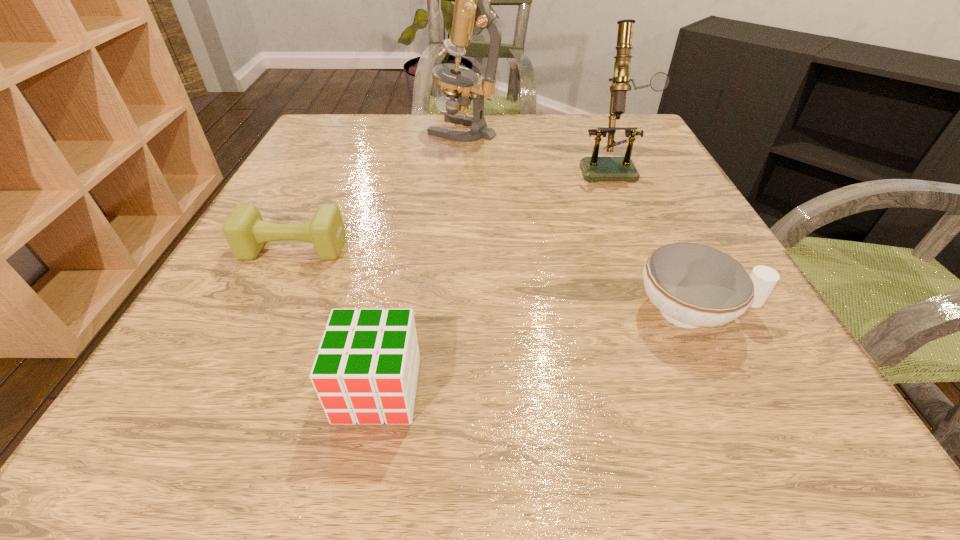
Image resolution: width=960 pixels, height=540 pixels. Find the location of `free point located at the eyepiece of the shorter microscope`. free point located at the eyepiece of the shorter microscope is located at coordinates (637, 228).

At what (x,y) coordinates should I click in order to perform the action: click on free region located on the right of the third nearest object. Please return your answer as a coordinate pair (x, y). The height and width of the screenshot is (540, 960). Looking at the image, I should click on (423, 249).

Find the location of `object located in the near edge section of the desktop`. object located in the near edge section of the desktop is located at coordinates (365, 371).

Where is `object at the left edge`? object at the left edge is located at coordinates (245, 231).

In order to click on microscope that is at the right edge in this screenshot , I will do `click(594, 168)`.

Image resolution: width=960 pixels, height=540 pixels. I want to click on chinaware that is positioned at the right edge, so click(x=693, y=285).

Find the location of a particular element. This screenshot has width=960, height=540. object positioned at the far right corner is located at coordinates (594, 168).

Find the location of a particular element. vacant space at the far edge is located at coordinates (576, 126).

What are the coordinates of `vacant space at the near edge of the desktop` in the screenshot? It's located at (279, 395).

Where is `vacant space at the left edge of the desktop`? This screenshot has height=540, width=960. vacant space at the left edge of the desktop is located at coordinates (287, 252).